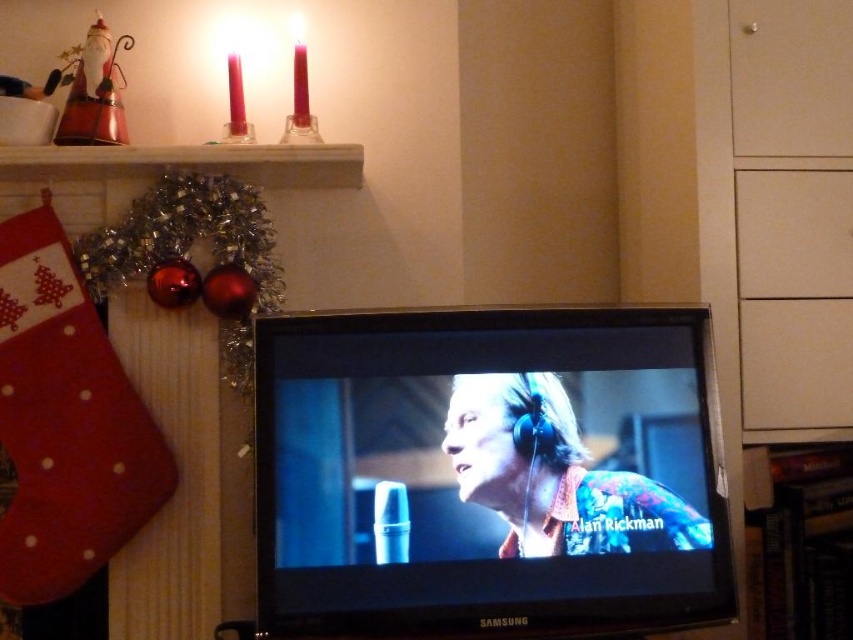
This screenshot has width=853, height=640. What are the coordinates of `matte black tv at center` in the screenshot? It's located at (488, 474).

Is point (32, 384) farther from viewer compared to point (781, 202)?

No, (32, 384) is in front of (781, 202).

Is red felt stocking at left wider than white matte drawer at upper right?

Indeed, red felt stocking at left has a greater width compared to white matte drawer at upper right.

Measure the distance between point [53,484] and camera.

4.38 feet

Find the location of `red felt stocking at left`. red felt stocking at left is located at coordinates (65, 422).

Who is more forward, (604, 600) or (788, 248)?

Point (604, 600) is in front.

Is matte black tv at center above white matte drawer at upper right?

No.

Who is more forward, (314, 634) or (808, 193)?

Positioned in front is point (314, 634).

This screenshot has height=640, width=853. I want to click on matte black tv at center, so click(488, 474).